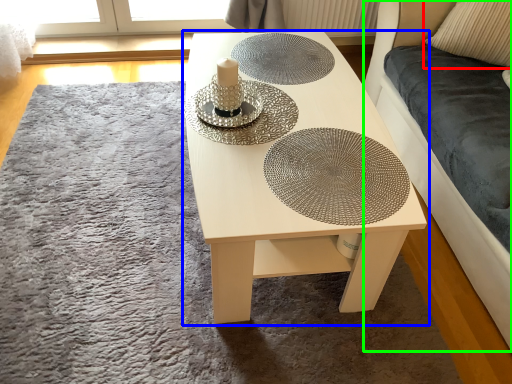
Question: Based on their relative distances, which object is farther from pillow (highlighted by a red box)? Choose from table (highlighted by a blue box) and couch (highlighted by a green box).

Choices:
 (A) table
 (B) couch

Answer: (A)